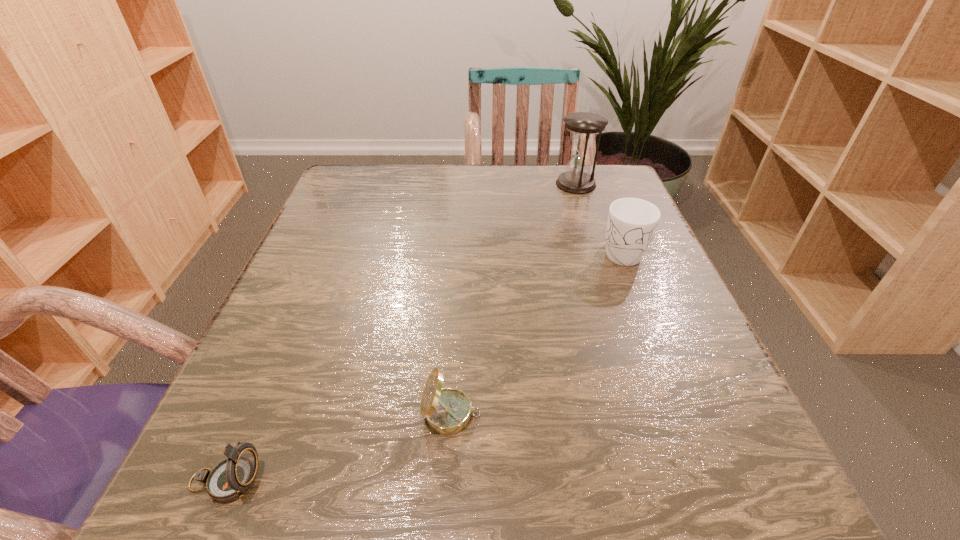
Locate an element on the screen. The width and height of the screenshot is (960, 540). blank space at the near edge of the desktop is located at coordinates (588, 464).

This screenshot has height=540, width=960. Find the location of `vacant region at the left edge`. vacant region at the left edge is located at coordinates (259, 336).

Locate an element on the screen. The height and width of the screenshot is (540, 960). free space at the right edge of the desktop is located at coordinates (688, 383).

I want to click on vacant space at the far left corner of the desktop, so click(393, 167).

Locate an element on the screen. blank area at the far right corner is located at coordinates (624, 174).

Image resolution: width=960 pixels, height=540 pixels. I want to click on vacant space at the near right corner of the desktop, so 736,475.

The height and width of the screenshot is (540, 960). Find the location of `free space between the hourglass and the second tallest object`. free space between the hourglass and the second tallest object is located at coordinates (598, 218).

This screenshot has height=540, width=960. Find the location of `free space between the hourglass and the second object from left to right`. free space between the hourglass and the second object from left to right is located at coordinates (514, 299).

At what (x,y) coordinates should I click in order to perform the action: click on vacant area between the right compass and the left compass. Please return your answer as a coordinate pair (x, y). Image resolution: width=960 pixels, height=540 pixels. Looking at the image, I should click on (338, 448).

Locate an element on the screen. free point between the nearer compass and the mug is located at coordinates (423, 366).